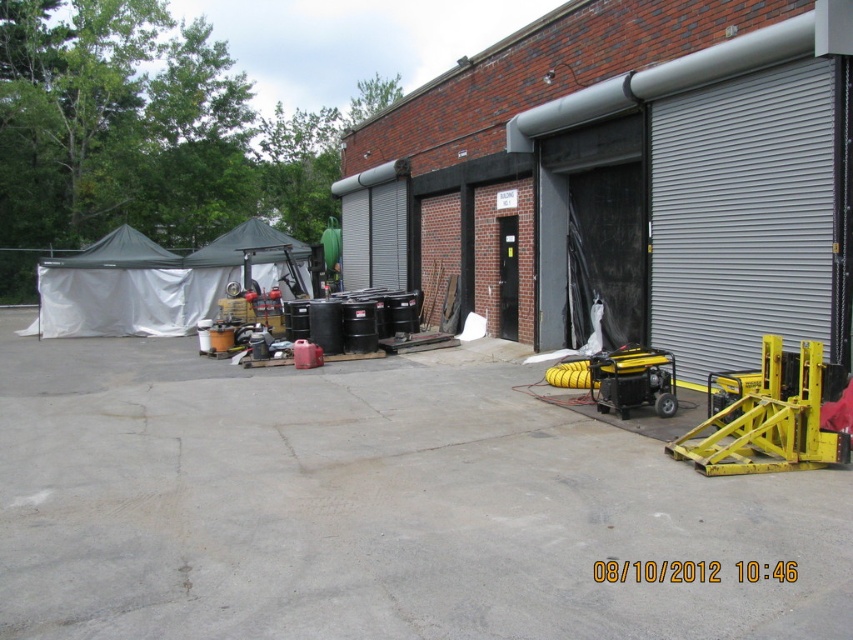
From the picture: You are a delivery driver who needs to park your truck that is 2.5 meters tall. You see the metallic gray shed at center and the gray metallic garage door at right. Which object is taller, and will your truck clear the height if you park between them?

The metallic gray shed at center is taller than the gray metallic garage door at right. Since the shed is taller, your truck must not park between them as it might hit the shed. However, if parking near the garage door, the truck should be okay since the garage door is shorter than the shed. But the exact height isn

You are a delivery person who needs to move a large box from the truck to the storage area. The truck is parked near the yellow metallic forklift at right and the yellow metallic generator at lower right. Can you safely maneuver the box between them without hitting either?

The yellow metallic forklift at right is 5.27 feet away from the yellow metallic generator at lower right. Since the distance is sufficient for maneuvering a large box, you can safely move the box between them without hitting either.